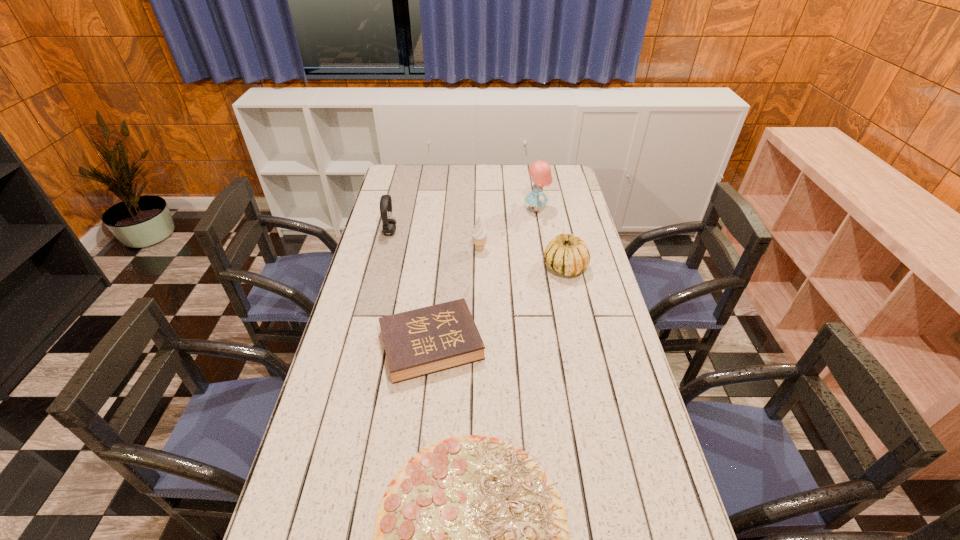
Identify the location of the tallest object. This screenshot has width=960, height=540. [540, 171].

Image resolution: width=960 pixels, height=540 pixels. Identify the location of the leftmost object. (389, 224).

The height and width of the screenshot is (540, 960). I want to click on icecream, so click(x=479, y=235).

Identify the location of gourd. This screenshot has height=540, width=960. (568, 254).

Find the location of a particular element. Image resolution: width=960 pixels, height=540 pixels. hardback book is located at coordinates (419, 342).

This screenshot has height=540, width=960. What are the coordinates of `the fifth farthest object` in the screenshot? It's located at (419, 342).

Where is `free spot located on the front-facing side of the tallest object`? free spot located on the front-facing side of the tallest object is located at coordinates (487, 210).

Where is `vacant point located on the front-facing side of the tallest object`? The width and height of the screenshot is (960, 540). vacant point located on the front-facing side of the tallest object is located at coordinates (464, 210).

Find the location of a particular element. free spot located 0.260m on the front-facing side of the tallest object is located at coordinates (464, 210).

Locate an element on the screen. This screenshot has width=960, height=540. free spot located on the front-facing side of the headset is located at coordinates (445, 232).